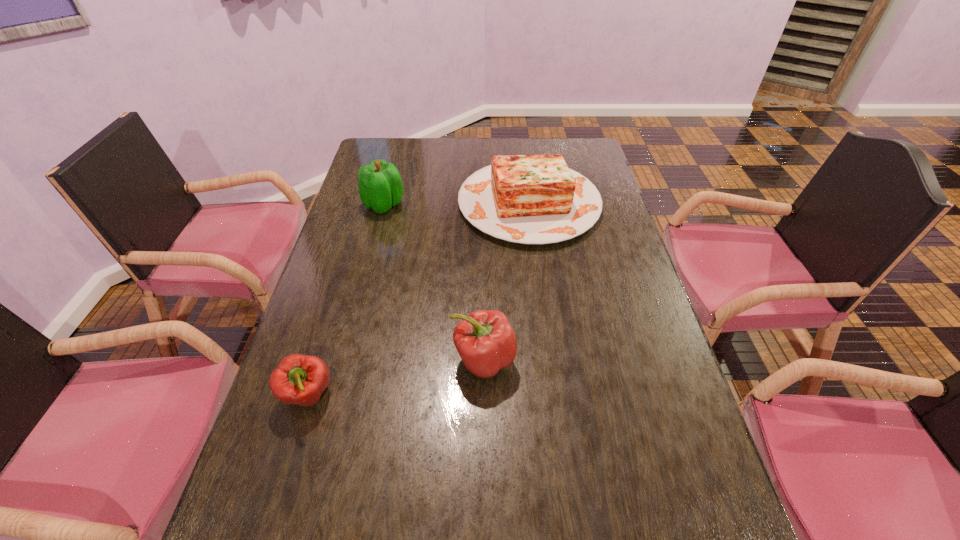
Where is `empty space between the lasagna and the farthest bell pepper`? Image resolution: width=960 pixels, height=540 pixels. empty space between the lasagna and the farthest bell pepper is located at coordinates (457, 204).

The width and height of the screenshot is (960, 540). I want to click on vacant point located between the shortest bell pepper and the farthest bell pepper, so click(347, 300).

You are a GUI agent. You are given a task and a screenshot of the screen. Output one action in this format:
    pyautogui.click(x=<x>, y=<y>)
    Task: Click on the vacant space that is in between the shortest bell pepper and the lasagna
    This screenshot has width=960, height=540.
    Given the screenshot: What is the action you would take?
    pyautogui.click(x=419, y=299)

You are a GUI agent. You are given a task and a screenshot of the screen. Output one action in this format:
    pyautogui.click(x=<x>, y=<y>)
    Task: Click on the vacant space that is in between the rightmost bell pepper and the farthest bell pepper
    This screenshot has width=960, height=540.
    Given the screenshot: What is the action you would take?
    pyautogui.click(x=434, y=282)

Where is `free area in between the lasagna and the shortest bell pepper`? This screenshot has width=960, height=540. free area in between the lasagna and the shortest bell pepper is located at coordinates (419, 299).

Identify which object is located as the nearest to the shortest bell pepper. Please provide its 2D coordinates. Your answer should be formatted as a tuple, i.e. [(x, y)], where the tuple contains the x and y coordinates of a point satisfying the conditions above.

[(486, 342)]

Select which object appears as the second closest to the farthest bell pepper. Please provide its 2D coordinates. Your answer should be formatted as a tuple, i.e. [(x, y)], where the tuple contains the x and y coordinates of a point satisfying the conditions above.

[(486, 342)]

At what (x,y) coordinates should I click in order to perform the action: click on bell pepper that is the second nearest to the farthest bell pepper. Please return your answer as a coordinate pair (x, y). Looking at the image, I should click on (299, 379).

Select which bell pepper appears as the third closest to the lasagna. Please provide its 2D coordinates. Your answer should be formatted as a tuple, i.e. [(x, y)], where the tuple contains the x and y coordinates of a point satisfying the conditions above.

[(299, 379)]

The image size is (960, 540). Find the location of `vacant region that satisfies the following two spatial constraints: 1. on the back side of the shortest bell pepper; 2. on the left side of the lasagna`. vacant region that satisfies the following two spatial constraints: 1. on the back side of the shortest bell pepper; 2. on the left side of the lasagna is located at coordinates (367, 203).